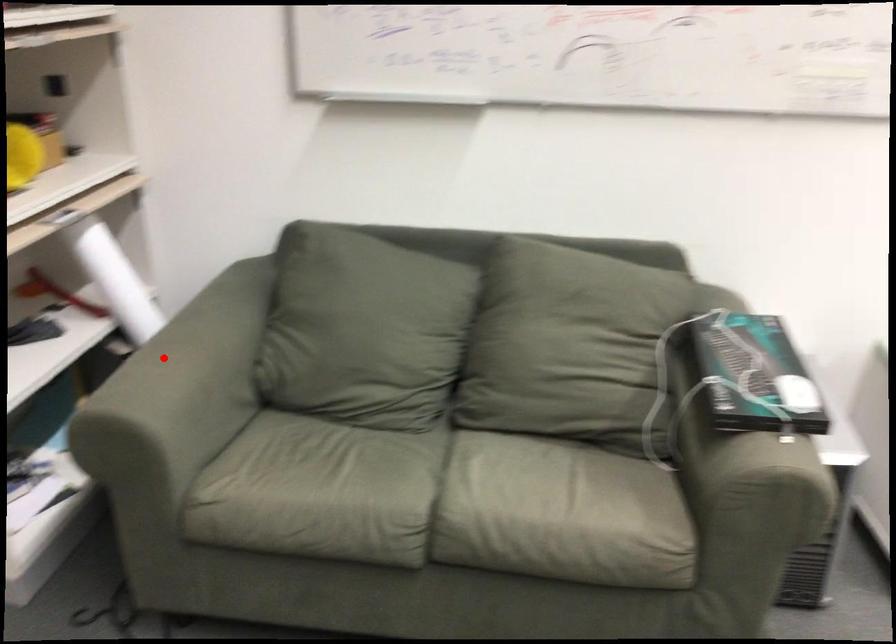
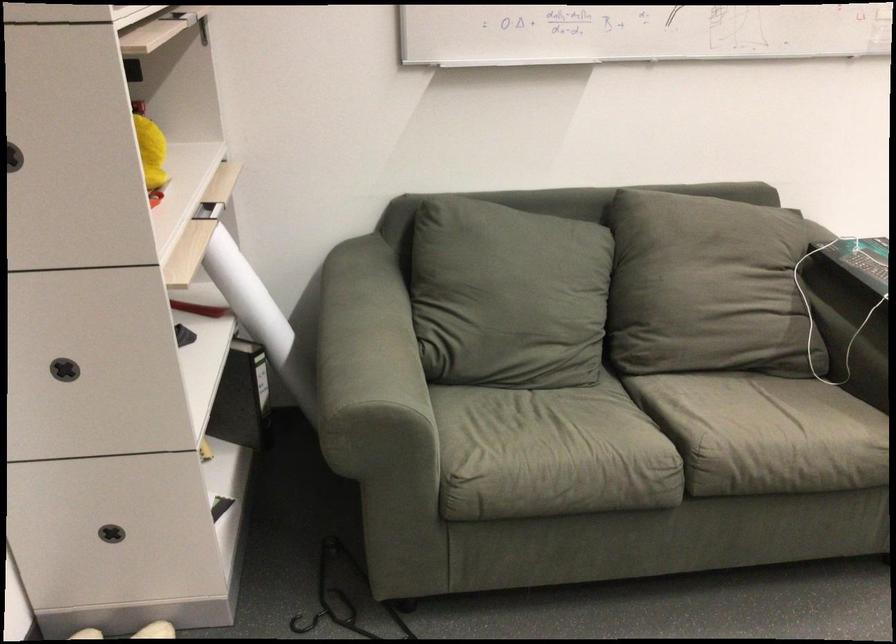
Where in the second image is the point corresponding to the highlighted location from the first image?

(358, 342)